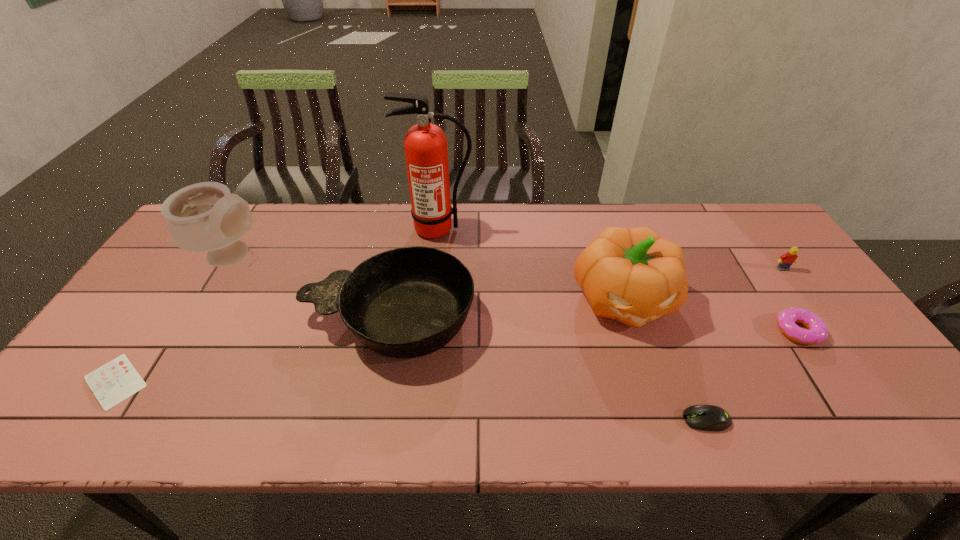
Where is `free space between the fourth tallest object and the third shortest object`? This screenshot has height=540, width=960. free space between the fourth tallest object and the third shortest object is located at coordinates (593, 325).

At what (x,y) coordinates should I click in order to perform the action: click on vacant point located between the second tallest object and the diary. Please return your answer as a coordinate pair (x, y). This screenshot has width=960, height=540. Looking at the image, I should click on (175, 319).

Identify which object is the fifth nearest to the sixth tallest object. Please provide its 2D coordinates. Your answer should be formatted as a tuple, i.e. [(x, y)], where the tuple contains the x and y coordinates of a point satisfying the conditions above.

[(426, 151)]

Locate an element on the screen. object that is the seventh nearest to the fifth shortest object is located at coordinates (786, 260).